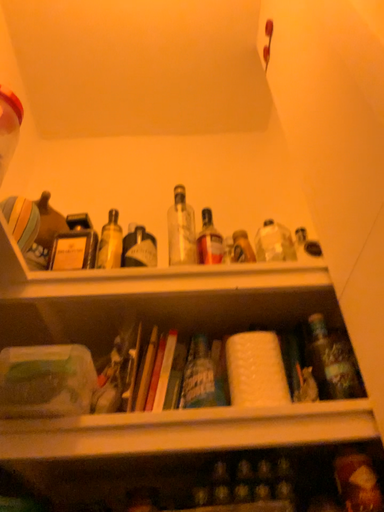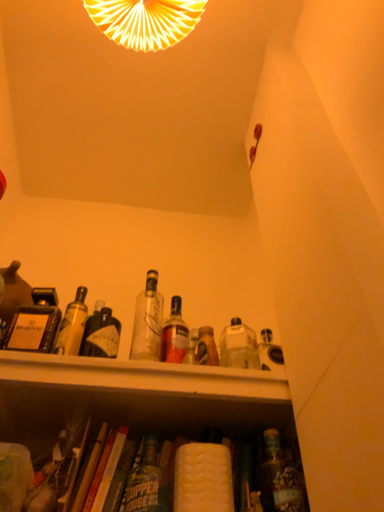
Question: How did the camera likely rotate when shooting the video?

Choices:
 (A) rotated upward
 (B) rotated downward

Answer: (A)